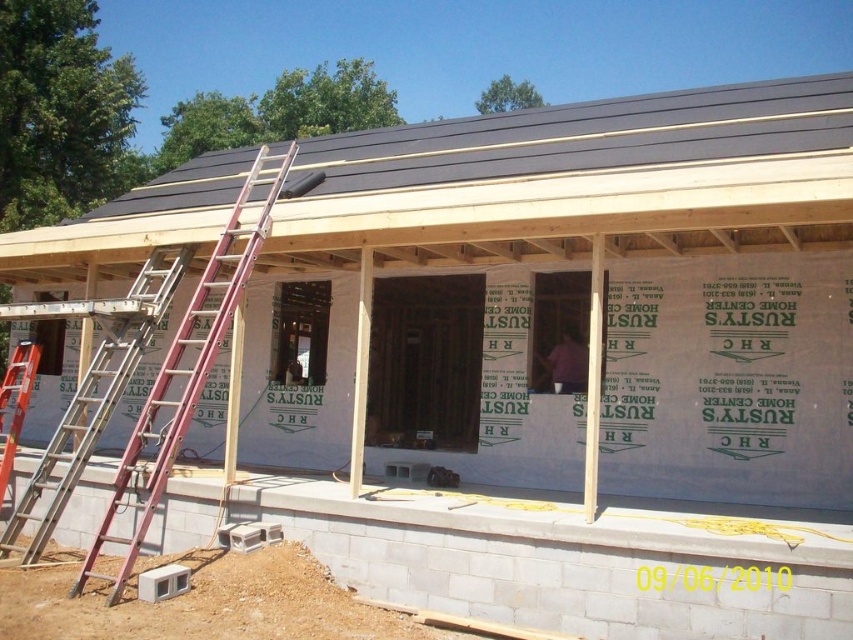
Who is positioned more to the left, dark gray shingles at upper center or orange metallic ladder at left?

orange metallic ladder at left

Measure the distance between point (494, 124) and camera.

Point (494, 124) and camera are 12.55 meters apart from each other.

This screenshot has width=853, height=640. What are the coordinates of `dark gray shingles at upper center` in the screenshot? It's located at (582, 179).

In the scene shown: Is metallic silver ladder at left positioned in front of silver metallic ladder at left?

No, it is behind silver metallic ladder at left.

This screenshot has height=640, width=853. What are the coordinates of `metallic silver ladder at left` in the screenshot? It's located at (187, 368).

In the scene shown: Between white foam insulation at center and dark gray shingles at upper center, which one has more height?

white foam insulation at center is taller.

Who is positioned more to the left, white foam insulation at center or dark gray shingles at upper center?

white foam insulation at center is more to the left.

Is point (791, 502) positioned before point (169, 188)?

Yes, it is in front of point (169, 188).

This screenshot has width=853, height=640. In order to click on white foam insulation at center in this screenshot , I will do `click(729, 380)`.